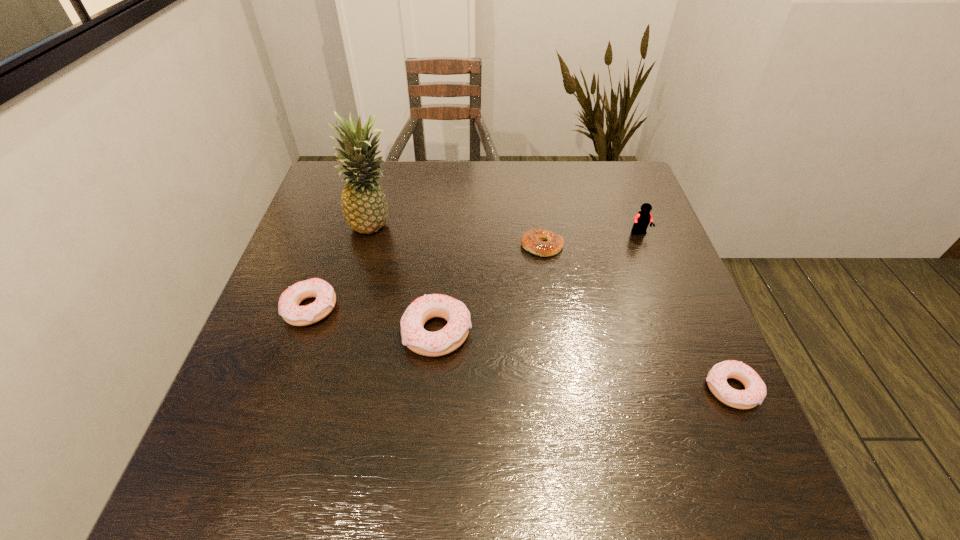
This screenshot has height=540, width=960. Identify the location of Lego present at the right edge. (641, 221).

The width and height of the screenshot is (960, 540). I want to click on object that is positioned at the near right corner, so click(x=755, y=389).

I want to click on vacant region at the far edge, so pos(573,177).

Find the location of a particular element. The image size is (960, 540). free space at the near edge of the desktop is located at coordinates (470, 422).

You are a GUI agent. You are given a task and a screenshot of the screen. Output one action in this format:
    pyautogui.click(x=<x>, y=<y>)
    Task: Click on the vacant space at the left edge of the desktop
    
    Given the screenshot: What is the action you would take?
    pyautogui.click(x=296, y=378)

Identify the location of free spot at the right edge of the desktop. (658, 332).

Identify the location of vacant space at the far left corner of the desktop. (334, 175).

Locate an element on the screen. The height and width of the screenshot is (540, 960). free location at the near left corner of the desktop is located at coordinates (286, 435).

Where is `free spot between the leftmost doughnut and the shortest object`? Image resolution: width=960 pixels, height=540 pixels. free spot between the leftmost doughnut and the shortest object is located at coordinates (427, 277).

Where is `free space between the shortest doughnut and the tallest object`? Image resolution: width=960 pixels, height=540 pixels. free space between the shortest doughnut and the tallest object is located at coordinates (553, 308).